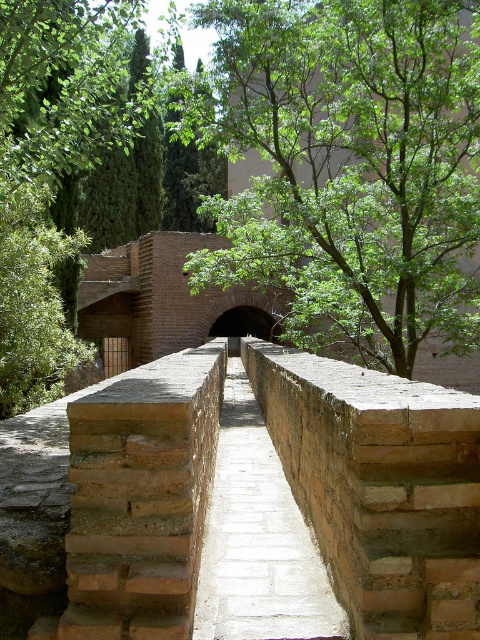
Is green leafy tree at center smaller than smooth stone path at center?

Yes, green leafy tree at center is smaller than smooth stone path at center.

Who is taller, green leafy tree at center or smooth stone path at center?

With more height is green leafy tree at center.

Between point (272, 97) and point (235, 618), which one is positioned behind?

The point (272, 97) is more distant.

This screenshot has width=480, height=640. Identify the location of green leafy tree at center. (350, 168).